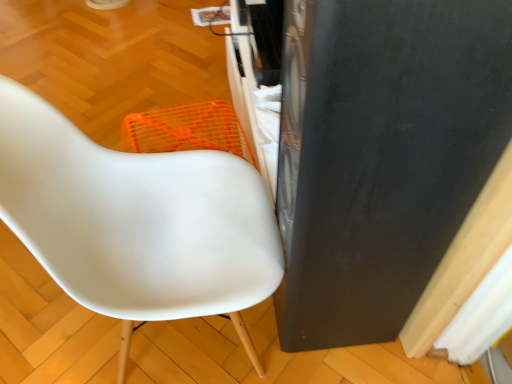
Question: Based on their sizes in the image, would you say white matte chair at center is bigger or smaller than black matte speaker at right?

Choices:
 (A) small
 (B) big

Answer: (B)

Question: From the image's perspective, is white matte chair at center positioned above or below black matte speaker at right?

Choices:
 (A) above
 (B) below

Answer: (B)

Question: Considering the positions of point (117, 299) and point (295, 59), is point (117, 299) closer or farther from the camera than point (295, 59)?

Choices:
 (A) closer
 (B) farther

Answer: (B)

Question: Considering the positions of point (338, 150) and point (117, 244), is point (338, 150) closer or farther from the camera than point (117, 244)?

Choices:
 (A) closer
 (B) farther

Answer: (A)

Question: Considering the relative positions of black matte speaker at right and white matte chair at center in the image provided, is black matte speaker at right to the left or to the right of white matte chair at center?

Choices:
 (A) right
 (B) left

Answer: (A)

Question: Is black matte speaker at right wider or thinner than white matte chair at center?

Choices:
 (A) wide
 (B) thin

Answer: (B)

Question: In terms of height, does black matte speaker at right look taller or shorter compared to white matte chair at center?

Choices:
 (A) short
 (B) tall

Answer: (B)